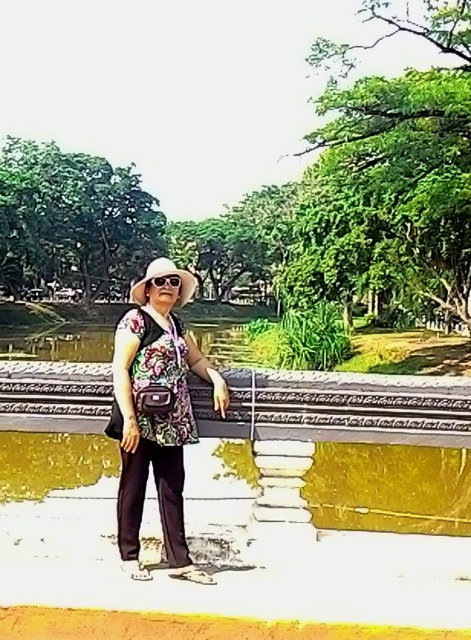
You are a photographer trying to capture the person in the scene. You notice the floral fabric blouse at center and the sunglasses at center. Which object is positioned closer to the camera? Please explain based on their positions.

The floral fabric blouse at center is closer to the viewer than the sunglasses at center, so the blouse would appear closer to the camera in the photograph.